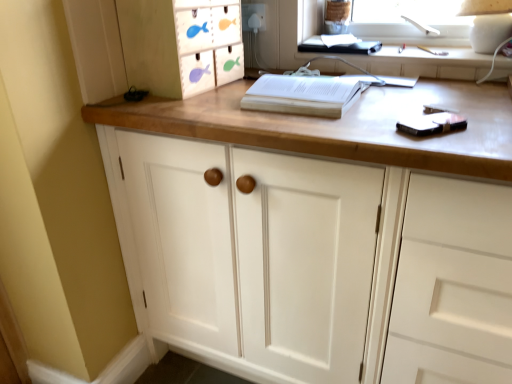
Where is `vacant area that is in front of white paper at center`? The height and width of the screenshot is (384, 512). vacant area that is in front of white paper at center is located at coordinates (344, 118).